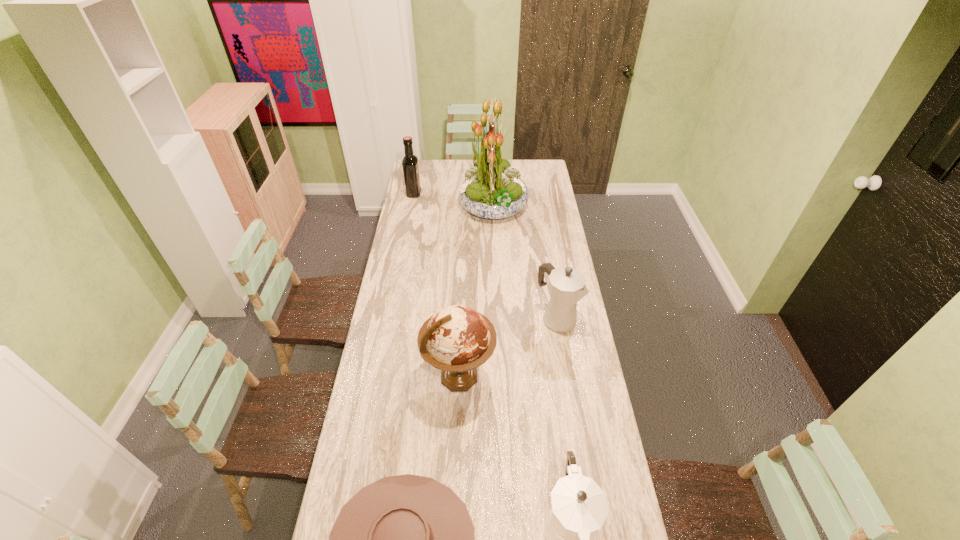
Image resolution: width=960 pixels, height=540 pixels. Find the location of `the tallest object`. the tallest object is located at coordinates (493, 189).

Find the location of a particular element. Image resolution: width=960 pixels, height=540 pixels. the fourth farthest object is located at coordinates (457, 339).

Identify the location of liquor. (410, 161).

Where is `the farther coffeepot`? Image resolution: width=960 pixels, height=540 pixels. the farther coffeepot is located at coordinates (567, 286).

The image size is (960, 540). What are the coordinates of `vacant space situated on the front-facing side of the tallest object` in the screenshot? It's located at (430, 207).

Image resolution: width=960 pixels, height=540 pixels. I want to click on free space located 0.300m on the front-facing side of the tallest object, so click(x=405, y=207).

Locate an element on the screen. The height and width of the screenshot is (540, 960). free space located on the front-facing side of the tallest object is located at coordinates (420, 207).

Identify the location of blank area located on the front of the globe showing Asia. coord(552,377).

Where is `free space located on the front-facing side of the liquor`? free space located on the front-facing side of the liquor is located at coordinates (445, 193).

Where is `vacant point located on the front of the fourth nearest object`? The width and height of the screenshot is (960, 540). vacant point located on the front of the fourth nearest object is located at coordinates (573, 423).